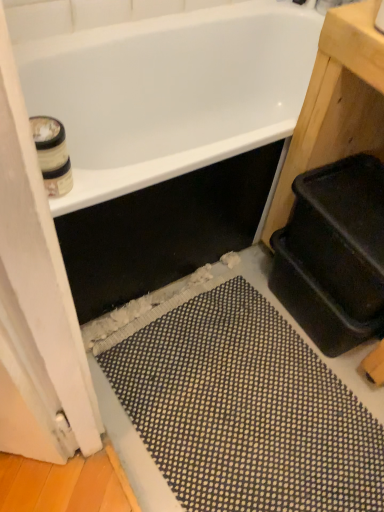
Identify the location of vacant space situated above black rubber bath mat at lower center (from a real-world perspective). (247, 390).